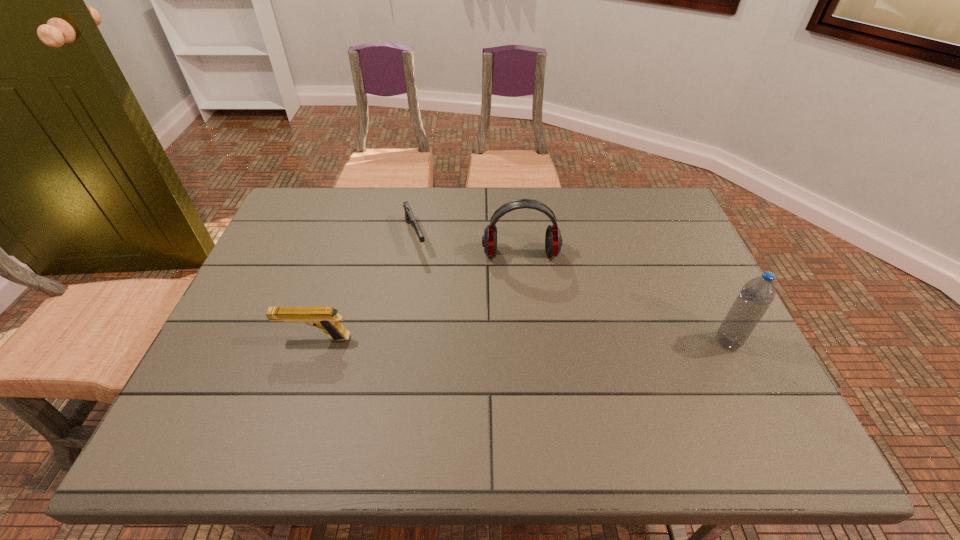
Identify the location of vacant spot on the desktop that is between the third tallest object and the water bottle and is positioned on the ear cups of the third object from left to right. This screenshot has width=960, height=540. (529, 340).

You are a GUI agent. You are given a task and a screenshot of the screen. Output one action in this format:
    pyautogui.click(x=<x>, y=<y>)
    Task: Click on the free space on the desktop that is between the leftmost object and the water bottle and is positioned at the muzzle end of the gun
    
    Given the screenshot: What is the action you would take?
    pyautogui.click(x=460, y=340)